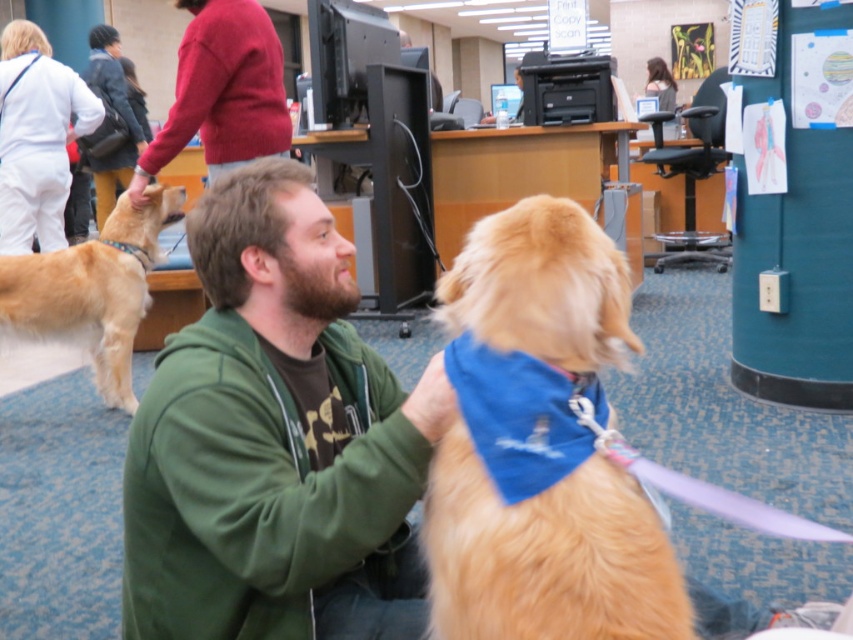
Question: Does golden fur dog at left appear under blue fabric neckband at center?

Choices:
 (A) yes
 (B) no

Answer: (B)

Question: Among these points, which one is nearest to the camera?

Choices:
 (A) (621, 522)
 (B) (114, 376)

Answer: (A)

Question: Which object is positioned farthest from the beardhairman's neck at center?

Choices:
 (A) golden fur dog at center
 (B) golden fur dog at left
 (C) green fleece jacket at center
 (D) blue fabric neckband at center

Answer: (B)

Question: Is blue fabric neckband at center above light brown fabric neckband at left?

Choices:
 (A) yes
 (B) no

Answer: (B)

Question: Where is green fleece jacket at center located in relation to blue fabric neckband at center in the image?

Choices:
 (A) above
 (B) below

Answer: (B)

Question: Which point is closer to the camera taking this photo?

Choices:
 (A) (370, 458)
 (B) (608, 259)
 (C) (99, 289)
 (D) (148, 264)

Answer: (B)